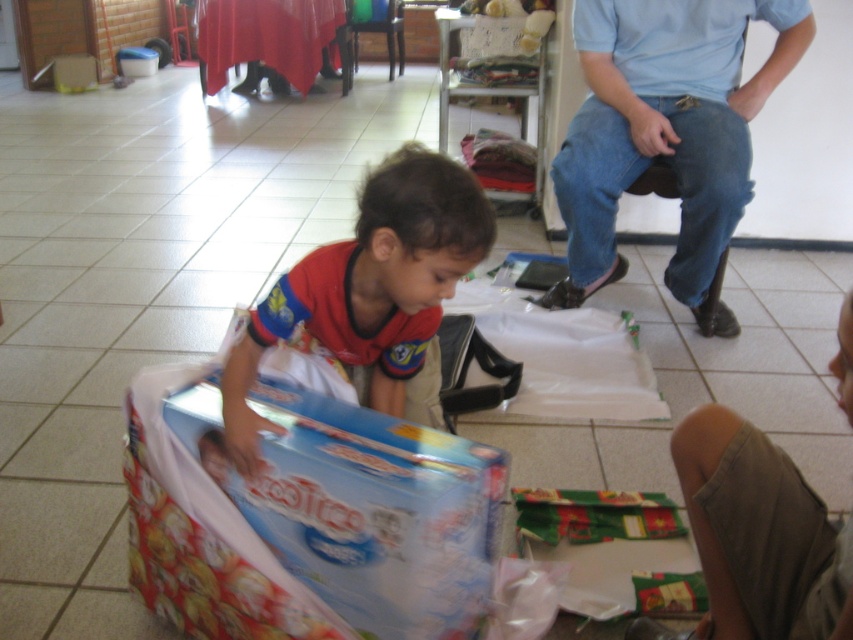
Question: Can you confirm if matte red shirt at center is positioned above khaki cotton shorts at lower right?

Choices:
 (A) no
 (B) yes

Answer: (B)

Question: Which is farther from the blue jeans at upper right?

Choices:
 (A) khaki cotton shorts at lower right
 (B) matte red shirt at center

Answer: (A)

Question: Which point is closer to the camera?

Choices:
 (A) (764, 634)
 (B) (717, 193)
 (C) (258, 420)

Answer: (A)

Question: Does blue jeans at upper right appear on the left side of khaki cotton shorts at lower right?

Choices:
 (A) no
 (B) yes

Answer: (A)

Question: Is blue jeans at upper right thinner than khaki cotton shorts at lower right?

Choices:
 (A) yes
 (B) no

Answer: (B)

Question: Which point is closer to the camera taking this photo?

Choices:
 (A) (250, 449)
 (B) (683, 129)
 (C) (849, 317)

Answer: (C)